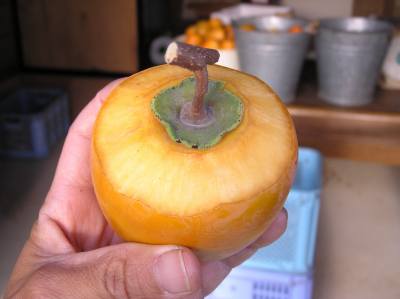
Where is `wood surface`? wood surface is located at coordinates (328, 119).